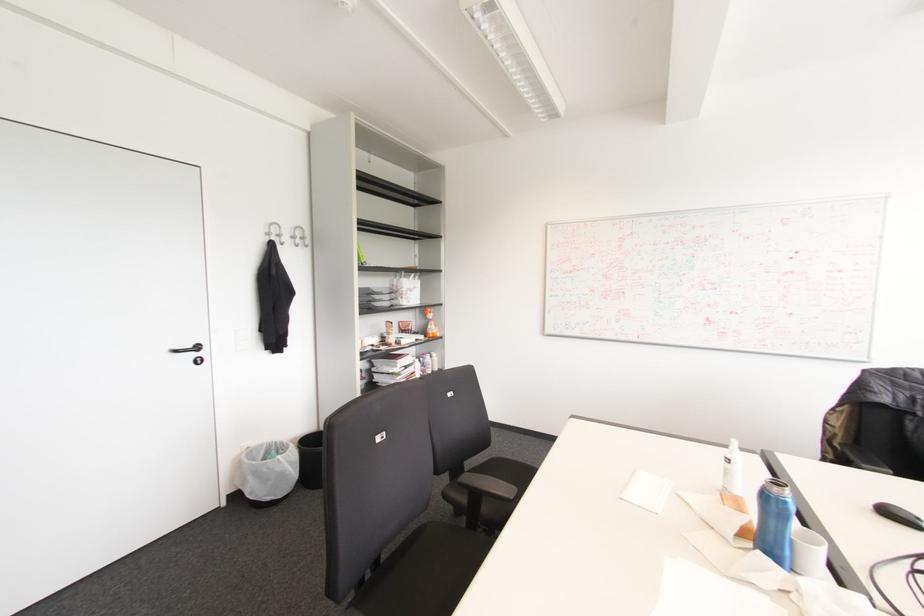
Where is `black door handle`? black door handle is located at coordinates (190, 352).